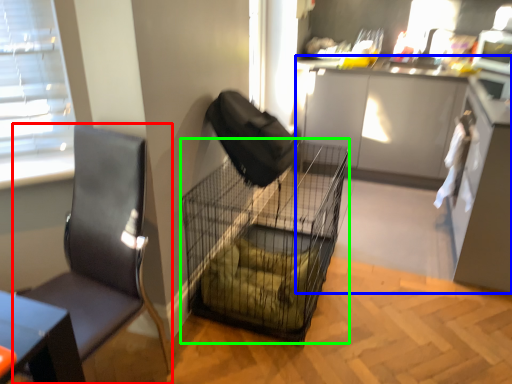
Question: Which object is the closest to the chair (highlighted by a red box)? Choose among these: cabinetry (highlighted by a blue box) or bird cage (highlighted by a green box).

Choices:
 (A) cabinetry
 (B) bird cage

Answer: (B)